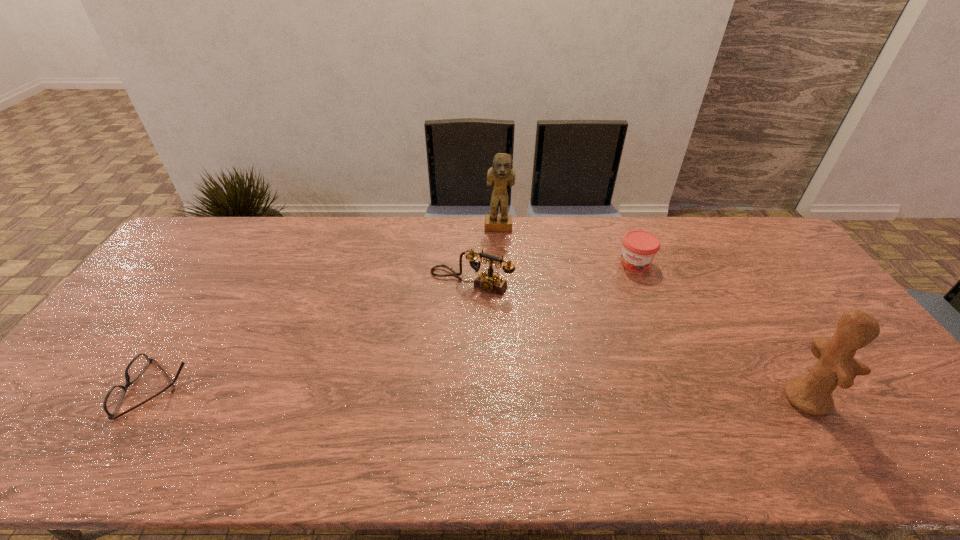
Find the location of a particular element. The width and height of the screenshot is (960, 540). vacant region located 0.080m on the front-facing side of the spectacles is located at coordinates (95, 389).

The image size is (960, 540). Identify the location of free space located 0.170m on the front-facing side of the nearer figurine. (897, 397).

You are a GUI agent. You are given a task and a screenshot of the screen. Output one action in this format:
    pyautogui.click(x=<x>, y=<y>)
    Task: Click on the vacant space situated 0.220m on the front-facing side of the farthest object
    Image resolution: width=960 pixels, height=540 pixels.
    Given the screenshot: What is the action you would take?
    pyautogui.click(x=502, y=275)

Locate an element on the screen. The width and height of the screenshot is (960, 540). vacant space located on the front-facing side of the farthest object is located at coordinates (503, 286).

You are a GUI agent. You are given a task and a screenshot of the screen. Output one action in this format:
    pyautogui.click(x=<x>, y=<y>)
    Task: Click on the vacant space located 0.070m on the front-facing side of the farthest object
    The image size is (960, 540).
    Given the screenshot: What is the action you would take?
    pyautogui.click(x=500, y=247)

Where is `vacant space situated 0.290m on the front label of the fourth tallest object`? This screenshot has width=960, height=540. vacant space situated 0.290m on the front label of the fourth tallest object is located at coordinates (598, 330).

Find the location of a particular element. free region located 0.280m on the front label of the fourth tallest object is located at coordinates (599, 328).

Find the location of a particular element. This screenshot has width=960, height=540. vacant region located 0.340m on the front label of the fourth tallest object is located at coordinates (591, 342).

Locate an element on the screen. The height and width of the screenshot is (540, 960). vacant space located on the front-facing side of the third tallest object is located at coordinates (411, 354).

At what (x,y) coordinates should I click in order to perform the action: click on vacant space situated on the front-facing side of the third tallest object. Please return your answer as a coordinate pair (x, y). The height and width of the screenshot is (540, 960). Looking at the image, I should click on (429, 329).